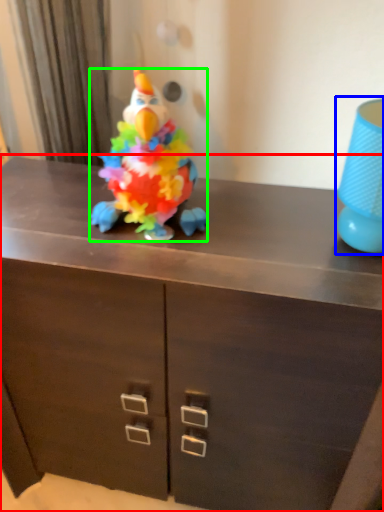
Question: Which object is positioned farthest from chest of drawers (highlighted by a red box)? Select from lamp (highlighted by a blue box) and toy (highlighted by a green box).

Choices:
 (A) lamp
 (B) toy

Answer: (A)